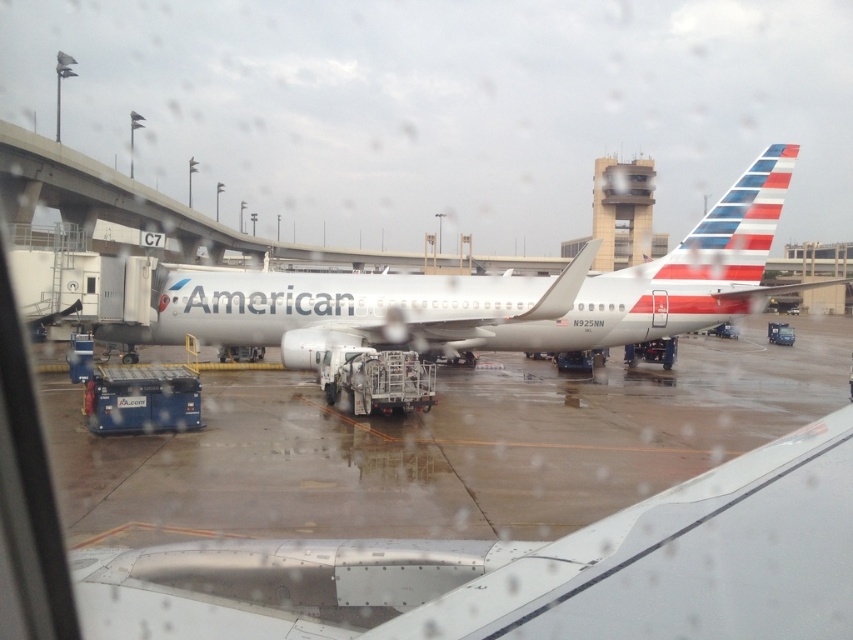
Question: Which object appears closest to the camera in this image?

Choices:
 (A) white glossy airplane at center
 (B) silver metallic winglet at lower center

Answer: (B)

Question: Observing the image, what is the correct spatial positioning of silver metallic winglet at lower center in reference to white glossy airplane at center?

Choices:
 (A) below
 (B) above

Answer: (A)

Question: Does silver metallic winglet at lower center appear over white glossy airplane at center?

Choices:
 (A) yes
 (B) no

Answer: (B)

Question: Which point is closer to the camera?

Choices:
 (A) silver metallic winglet at lower center
 (B) white glossy airplane at center

Answer: (A)

Question: Which point is closer to the camera?

Choices:
 (A) (732, 276)
 (B) (614, 588)

Answer: (B)

Question: Does silver metallic winglet at lower center appear on the left side of white glossy airplane at center?

Choices:
 (A) yes
 (B) no

Answer: (A)